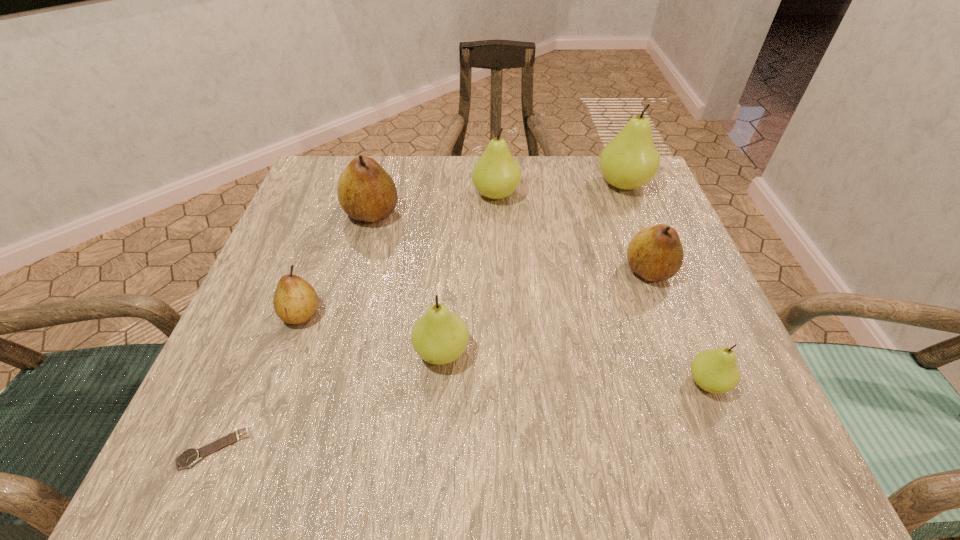
This screenshot has width=960, height=540. I want to click on free point between the nearest brown pear and the nearest object, so click(x=257, y=381).

In order to click on free space between the biggest green pear and the smallest green pear in this screenshot , I will do `click(665, 284)`.

Locate an element on the screen. This screenshot has width=960, height=540. vacant space in between the smallest green pear and the second biggest green pear is located at coordinates (602, 289).

The width and height of the screenshot is (960, 540). I want to click on vacant area that lies between the smallest green pear and the second smallest brown pear, so click(x=678, y=327).

Find the location of a particular element. Image resolution: width=960 pixels, height=540 pixels. free space that is in between the smallest green pear and the second biggest green pear is located at coordinates (602, 289).

Find the location of a particular element. The height and width of the screenshot is (540, 960). free space that is in between the nearest brown pear and the smallest green pear is located at coordinates (504, 348).

What are the coordinates of `free spot between the watch and the third biggest green pear` in the screenshot? It's located at (327, 400).

At what (x,y) coordinates should I click in order to perform the action: click on vacant space that is in between the third smallest green pear and the biggest green pear. Please return your answer as a coordinate pair (x, y). This screenshot has width=960, height=540. Looking at the image, I should click on (560, 190).

At what (x,y) coordinates should I click in order to perform the action: click on object that can be found as the third closest to the nearest object. Please return your answer as a coordinate pair (x, y). This screenshot has height=540, width=960. Looking at the image, I should click on (366, 192).

Locate an element on the screen. the seventh closest object relative to the smallest brown pear is located at coordinates (630, 160).